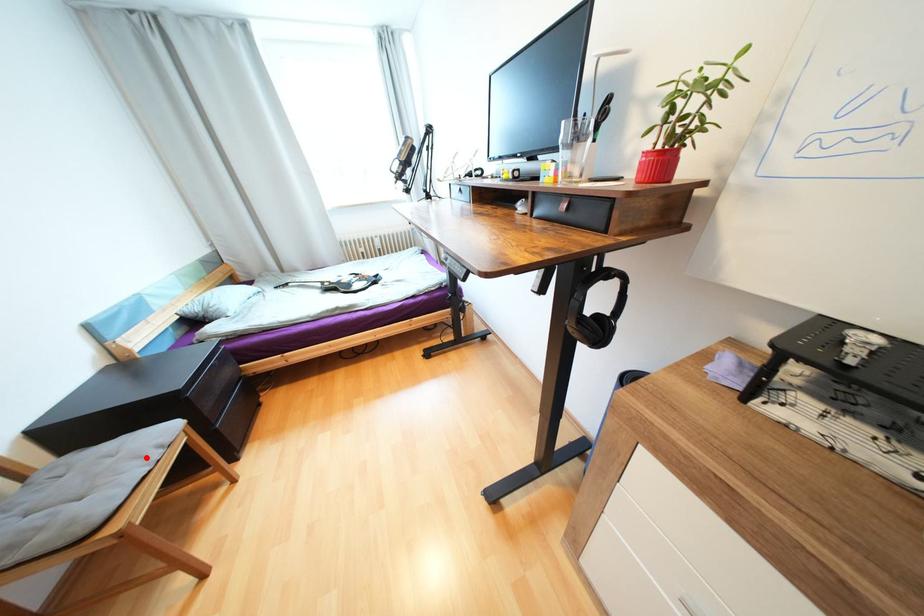
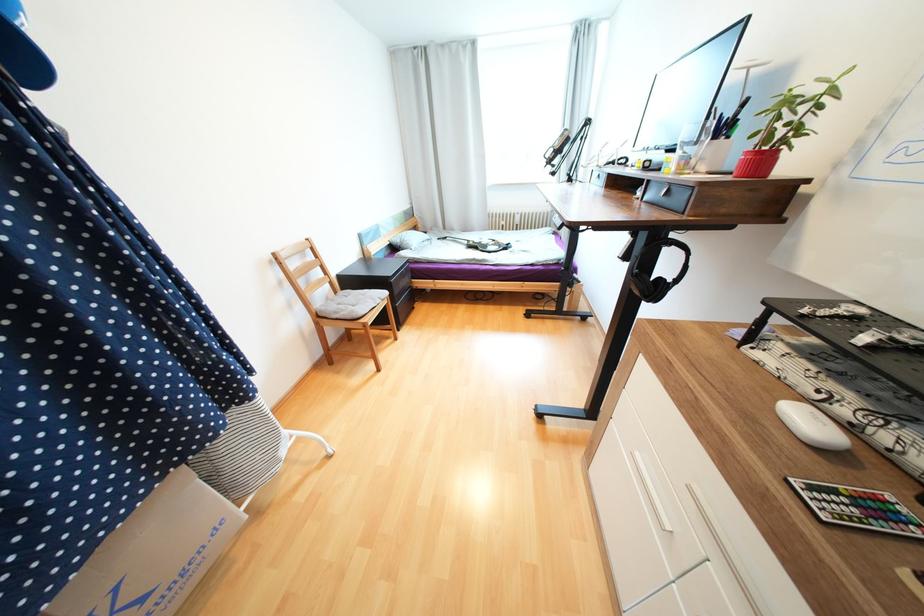
Question: I am providing you with two images of the same scene from different viewpoints. A red point is shown in image1. For the corresponding object point in image2, is it positioned nearer or farther from the camera?

Choices:
 (A) Nearer
 (B) Farther

Answer: (A)